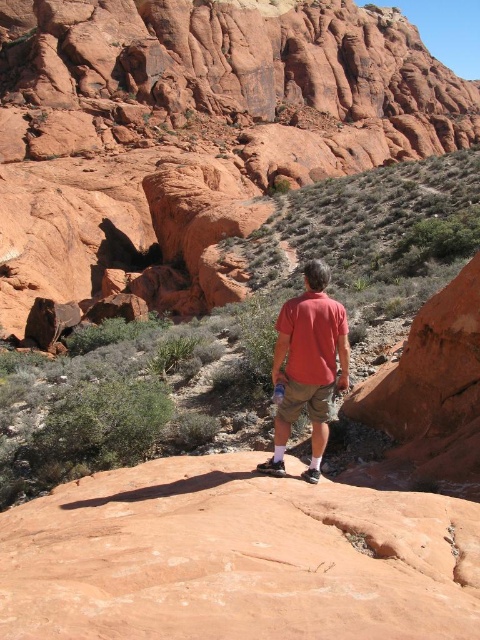
Which is more to the left, matte red shirt at center or khaki cotton shorts at center?

From the viewer's perspective, khaki cotton shorts at center appears more on the left side.

Between matte red shirt at center and khaki cotton shorts at center, which one is positioned higher?

Positioned higher is matte red shirt at center.

You are a GUI agent. You are given a task and a screenshot of the screen. Output one action in this format:
    pyautogui.click(x=<x>, y=<y>)
    Task: Click on the matte red shirt at center
    The height and width of the screenshot is (640, 480).
    Given the screenshot: What is the action you would take?
    (x=308, y=365)